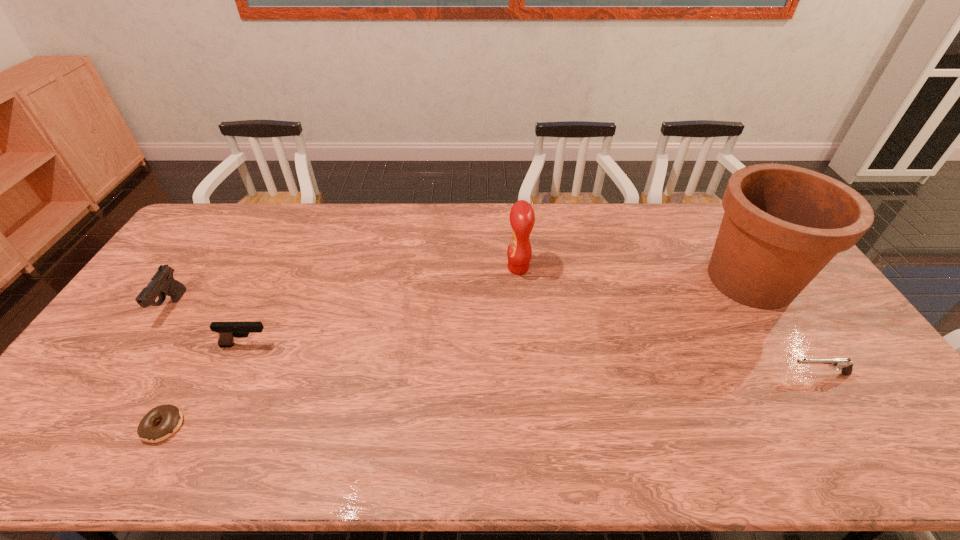
In order to click on vacant space located 0.180m on the right of the nearest object in this screenshot , I will do `click(258, 426)`.

Find the location of a particular element. This screenshot has width=960, height=540. object that is at the near edge is located at coordinates (171, 417).

Locate an element on the screen. The height and width of the screenshot is (540, 960). object that is positioned at the left edge is located at coordinates (162, 283).

Locate an element on the screen. flowerpot that is positioned at the right edge is located at coordinates (782, 224).

Identify the location of pistol at the right edge. Image resolution: width=960 pixels, height=540 pixels. (842, 364).

At what (x,y) coordinates should I click in order to perform the action: click on vacant space at the far edge of the desktop. Please return your answer as a coordinate pair (x, y). Looking at the image, I should click on (706, 212).

Image resolution: width=960 pixels, height=540 pixels. Find the location of `free region at the near edge of the desktop`. free region at the near edge of the desktop is located at coordinates (319, 461).

The width and height of the screenshot is (960, 540). In order to click on free space at the left edge of the desktop in this screenshot , I will do `click(109, 417)`.

Identify the location of vacant space at the right edge of the desktop. Image resolution: width=960 pixels, height=540 pixels. (830, 379).

Identify the location of free space at the far left corner. (210, 238).